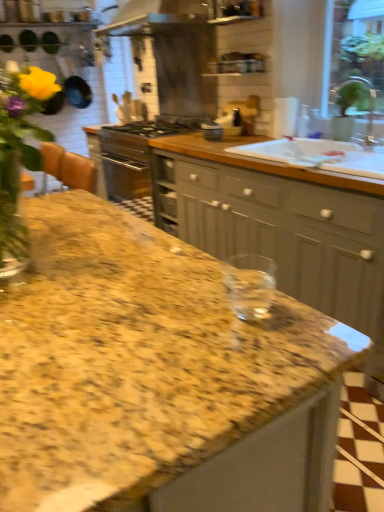
Question: Considering the relative sizes of white ceramic sink at upper right and matte gray cabinets at center in the image provided, is white ceramic sink at upper right taller than matte gray cabinets at center?

Choices:
 (A) yes
 (B) no

Answer: (B)

Question: Does white ceramic sink at upper right have a lesser height compared to matte gray cabinets at center?

Choices:
 (A) no
 (B) yes

Answer: (B)

Question: From a real-world perspective, is white ceramic sink at upper right over matte gray cabinets at center?

Choices:
 (A) yes
 (B) no

Answer: (A)

Question: Is white ceramic sink at upper right further to camera compared to matte gray cabinets at center?

Choices:
 (A) yes
 (B) no

Answer: (A)

Question: Could you tell me if white ceramic sink at upper right is facing matte gray cabinets at center?

Choices:
 (A) no
 (B) yes

Answer: (B)

Question: In the image, is granite at center positioned in front of or behind satin silver exhaust hood at upper center?

Choices:
 (A) front
 (B) behind

Answer: (A)

Question: From the image's perspective, is granite at center located above or below satin silver exhaust hood at upper center?

Choices:
 (A) above
 (B) below

Answer: (B)

Question: From a real-world perspective, is granite at center positioned above or below satin silver exhaust hood at upper center?

Choices:
 (A) below
 (B) above

Answer: (A)

Question: Would you say granite at center is inside or outside satin silver exhaust hood at upper center?

Choices:
 (A) outside
 (B) inside

Answer: (A)

Question: Considering the positions of point coord(302,160) and point coord(218,138), is point coord(302,160) closer or farther from the camera than point coord(218,138)?

Choices:
 (A) closer
 (B) farther

Answer: (A)

Question: From the image's perspective, is white ceramic sink at upper right located above or below matte black kettle at center, arranged as the 1th appliance when viewed from the front?

Choices:
 (A) above
 (B) below

Answer: (B)

Question: Relative to matte black kettle at center, arranged as the 1th appliance when viewed from the front, is white ceramic sink at upper right in front or behind?

Choices:
 (A) front
 (B) behind

Answer: (A)

Question: Looking at their shapes, would you say white ceramic sink at upper right is wider or thinner than matte black kettle at center, which is the 2th appliance from back to front?

Choices:
 (A) wide
 (B) thin

Answer: (A)

Question: From a real-world perspective, is satin silver exhaust hood at upper center positioned above or below white ceramic sink at upper right?

Choices:
 (A) below
 (B) above

Answer: (B)

Question: Do you think satin silver exhaust hood at upper center is within white ceramic sink at upper right, or outside of it?

Choices:
 (A) outside
 (B) inside

Answer: (A)